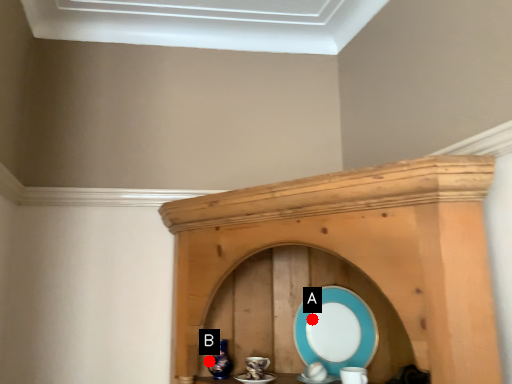
Question: Two points are circled on the image, labeled by A and B beside each circle. Which point is farther to the camera?

Choices:
 (A) A is further
 (B) B is further

Answer: (A)